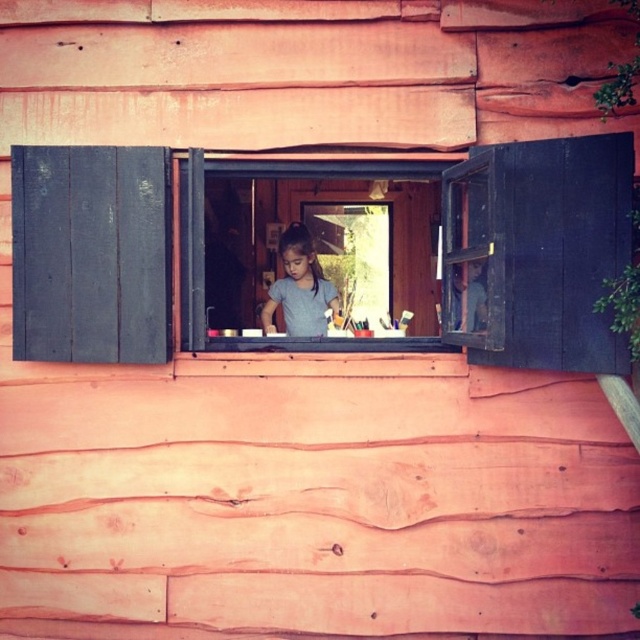
You are standing outside the rustic wooden cabin and notice the wooden window at center and the gray matte shirt at center. Which object appears smaller in size from your perspective?

The wooden window at center appears smaller than the gray matte shirt at center from your perspective.

You are a delivery person standing outside the rustic wooden cabin. You need to hand a package to the person inside, who is wearing the gray matte shirt at center. The wooden window at center is the only opening available. Can you reach them through the window if you are 1.8 meters tall?

The wooden window at center is 2.15 meters away from the gray matte shirt at center. Since you are 1.8 meters tall, you cannot reach them through the window as the distance is greater than your height.